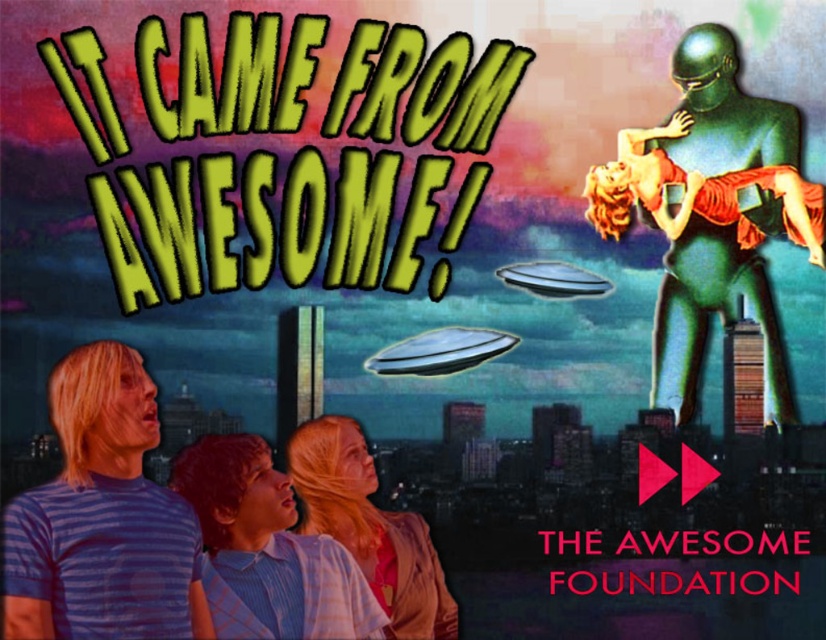
Does green metallic alien at upper right have a lesser width compared to light blue striped shirt at lower left?

Incorrect, green metallic alien at upper right's width is not less than light blue striped shirt at lower left's.

Does green metallic alien at upper right lie behind light blue striped shirt at lower left?

Yes, green metallic alien at upper right is further from the viewer.

Describe the element at coordinates (711, 216) in the screenshot. This screenshot has height=640, width=826. I see `green metallic alien at upper right` at that location.

In order to click on green metallic alien at upper right in this screenshot , I will do `click(711, 216)`.

Is purple striped t-shirt at lower left taller than light blue striped shirt at lower left?

Indeed, purple striped t-shirt at lower left has a greater height compared to light blue striped shirt at lower left.

Who is positioned more to the right, purple striped t-shirt at lower left or light blue striped shirt at lower left?

From the viewer's perspective, light blue striped shirt at lower left appears more on the right side.

What do you see at coordinates (102, 518) in the screenshot? Image resolution: width=826 pixels, height=640 pixels. I see `purple striped t-shirt at lower left` at bounding box center [102, 518].

I want to click on purple striped t-shirt at lower left, so click(x=102, y=518).

Between point (692, 90) and point (293, 464), which one is positioned behind?

The point (692, 90) is behind.

Which of these two, green metallic alien at upper right or blonde hair at center, stands shorter?

With less height is blonde hair at center.

Identify the location of green metallic alien at upper right. (711, 216).

The width and height of the screenshot is (826, 640). What are the coordinates of `green metallic alien at upper right` in the screenshot? It's located at (711, 216).